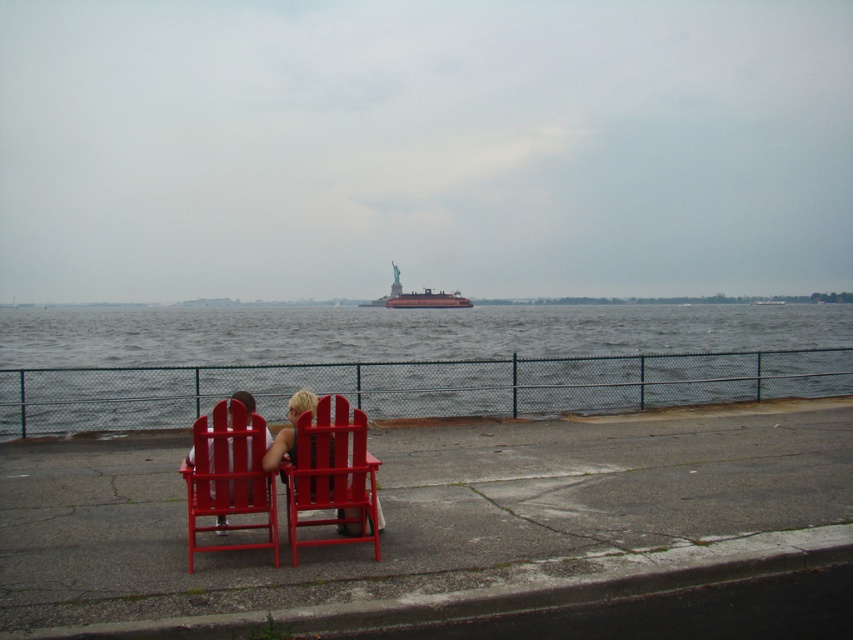
Question: Which of these objects is positioned closest to the gray water at center?

Choices:
 (A) matte wood chairs at center
 (B) matte wood chair at center
 (C) metallic gray ferry at center

Answer: (C)

Question: Which point appears farthest from the camera in this image?

Choices:
 (A) (288, 435)
 (B) (271, 381)
 (C) (294, 486)

Answer: (B)

Question: Is gray water at center closer to camera compared to matte wood chairs at center?

Choices:
 (A) yes
 (B) no

Answer: (B)

Question: Which point appears closest to the camera in this image?

Choices:
 (A) (408, 304)
 (B) (287, 436)

Answer: (B)

Question: Does matte wood chair at center lie in front of smooth glossy wood chair at center?

Choices:
 (A) yes
 (B) no

Answer: (B)

Question: Does gray water at center appear on the left side of matte wood chair at center?

Choices:
 (A) yes
 (B) no

Answer: (A)